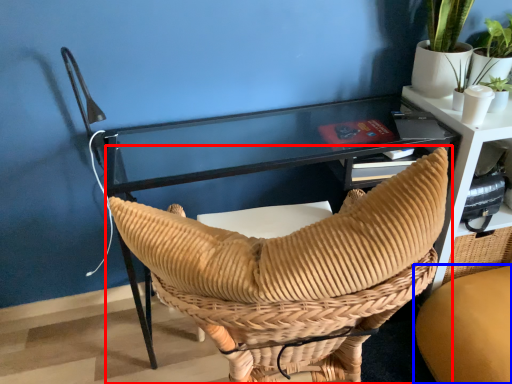
Question: Which of the following is the farthest to the observer, chair (highlighted by a red box) or chair (highlighted by a blue box)?

Choices:
 (A) chair
 (B) chair

Answer: (B)